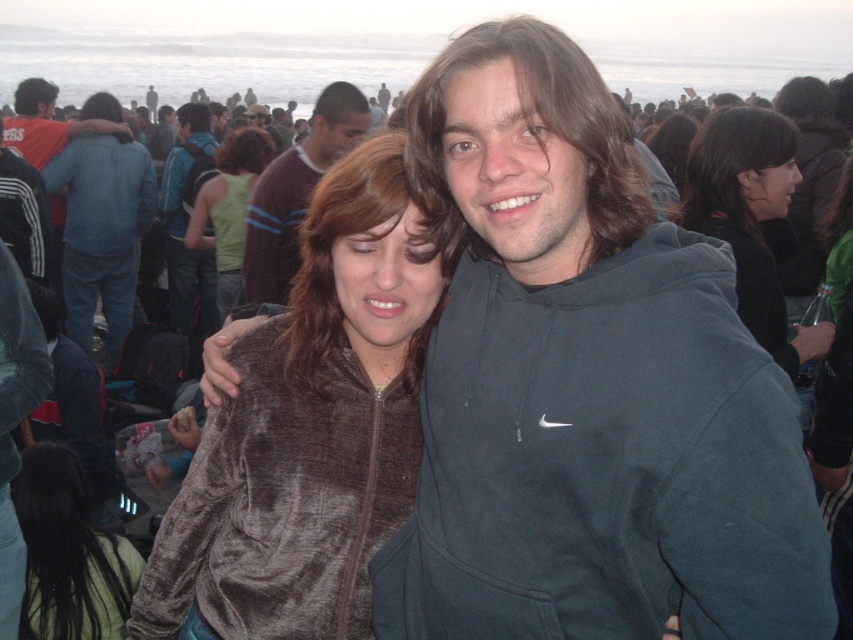
Who is positioned more to the left, velvet brown jacket at lower left or dark brown sweater at center?

Positioned to the left is dark brown sweater at center.

Is point (44, 600) positioned behind point (263, 292)?

No, (44, 600) is closer to viewer.

What are the coordinates of `velvet brown jacket at lower left` in the screenshot? It's located at (68, 554).

Between velvet brown jacket at center and dark brown sweater at center, which one has less height?

Standing shorter between the two is velvet brown jacket at center.

Is point (364, 458) more distant than point (248, 248)?

That is False.

Where is `velvet brown jacket at center`? The image size is (853, 640). velvet brown jacket at center is located at coordinates (308, 433).

Between dark brown sweater at center and green jersey at center, which one has less height?

Standing shorter between the two is green jersey at center.

The height and width of the screenshot is (640, 853). What do you see at coordinates (294, 193) in the screenshot?
I see `dark brown sweater at center` at bounding box center [294, 193].

Identify the location of dark brown sweater at center. The width and height of the screenshot is (853, 640). (294, 193).